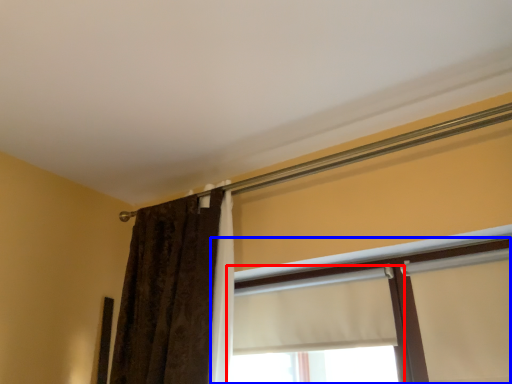
Question: Among these objects, which one is farthest to the camera, window (highlighted by a red box) or window (highlighted by a blue box)?

Choices:
 (A) window
 (B) window

Answer: (A)